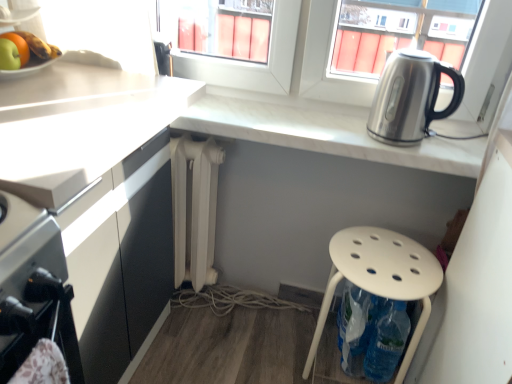
Identify the location of unoccupied region to the right of shiny metallic bowl at upper left. (92, 72).